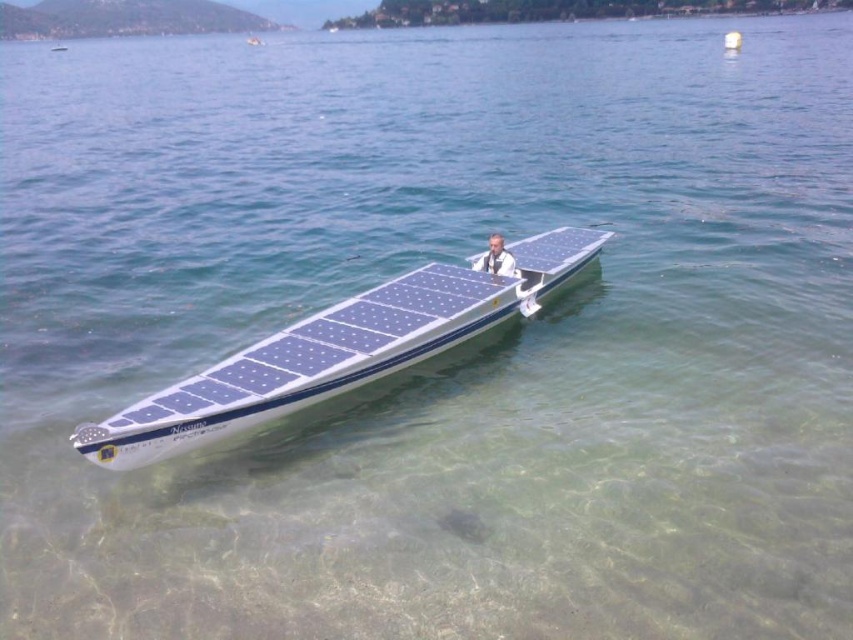
Consider the image. You are standing on the shore and want to know the exact position of the blue solar panel boat at center in the image. What are its coordinates?

The blue solar panel boat at center is located at coordinates (335, 352).

You are a photographer standing on the shore of the lake. You want to take a photo of the blue solar panel boat at center and the light brown leather jacket at center. Which object should you focus on first if you want to capture both in the same frame without moving the camera?

You should focus on the blue solar panel boat at center first because it is taller than the light brown leather jacket at center, ensuring it is in focus while the jacket remains within the depth of field.